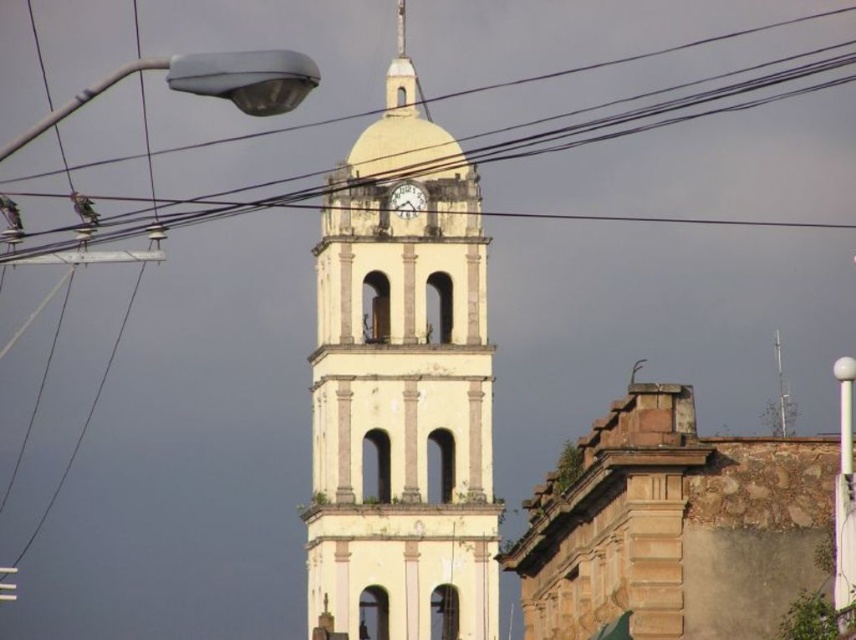
Which is more to the left, brown stone church at center or white glossy pole at upper right?

From the viewer's perspective, brown stone church at center appears more on the left side.

Locate an element on the screen. The height and width of the screenshot is (640, 856). brown stone church at center is located at coordinates (688, 528).

You are a GUI agent. You are given a task and a screenshot of the screen. Output one action in this format:
    pyautogui.click(x=<x>, y=<y>)
    Task: Click on the brown stone church at center
    This screenshot has width=856, height=640.
    Given the screenshot: What is the action you would take?
    pyautogui.click(x=688, y=528)

Is white stone clock tower at center closer to the viewer compared to white glossy pole at upper right?

No, it is not.

What do you see at coordinates (401, 397) in the screenshot? I see `white stone clock tower at center` at bounding box center [401, 397].

The image size is (856, 640). I want to click on white stone clock tower at center, so click(x=401, y=397).

Does smooth white spire at upper center appear on the right side of white glossy clock at center?

Incorrect, smooth white spire at upper center is not on the right side of white glossy clock at center.

Does smooth white spire at upper center have a smaller size compared to white glossy clock at center?

Incorrect, smooth white spire at upper center is not smaller in size than white glossy clock at center.

The height and width of the screenshot is (640, 856). Find the location of `smooth white spire at upper center`. smooth white spire at upper center is located at coordinates (401, 74).